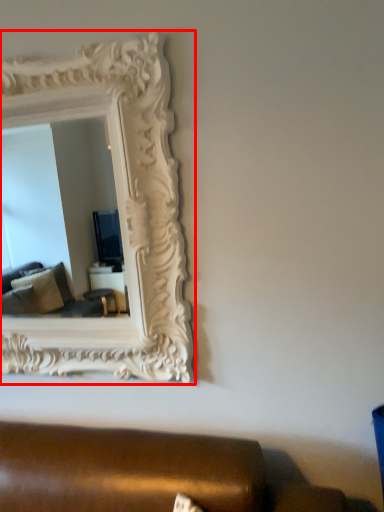
Question: From the image's perspective, what is the correct spatial relationship of picture frame (annotated by the red box) in relation to studio couch?

Choices:
 (A) below
 (B) above

Answer: (B)